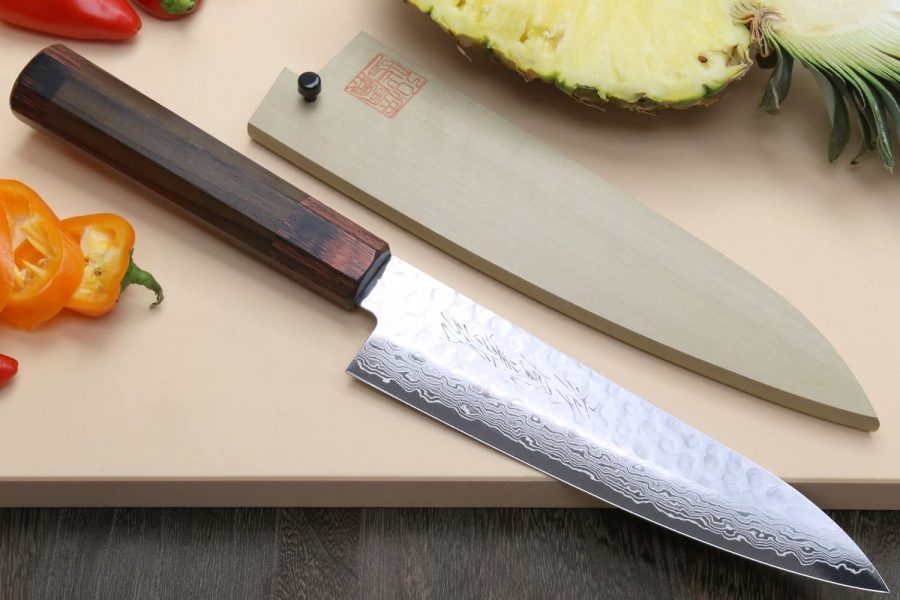
Identify the location of knob. The height and width of the screenshot is (600, 900). (310, 69).